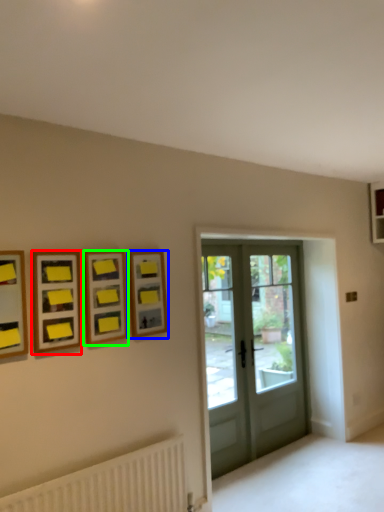
Question: Which object is positioned closest to picture frame (highlighted by a red box)? Select from picture frame (highlighted by a blue box) and picture frame (highlighted by a green box).

Choices:
 (A) picture frame
 (B) picture frame

Answer: (B)